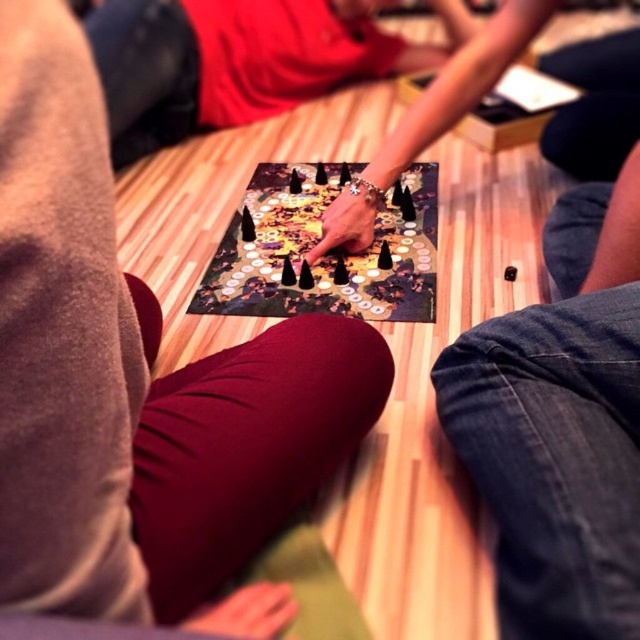
Between point (588, 576) and point (195, 83), which one is positioned in front?

Point (588, 576)

From the picture: Between denim pants at lower right and smooth red shirt at center, which one appears on the left side from the viewer's perspective?

smooth red shirt at center is more to the left.

Is point (595, 486) positioned after point (227, 60)?

No, it is not.

The image size is (640, 640). Find the location of `denim pants at lower right`. denim pants at lower right is located at coordinates (561, 422).

Who is higher up, denim pants at lower right or black plastic board game at center?

black plastic board game at center

Can you confirm if denim pants at lower right is positioned above black plastic board game at center?

No.

Between point (500, 445) and point (262, 192), which one is positioned behind?

The point (262, 192) is behind.

Where is `denim pants at lower right`? The image size is (640, 640). denim pants at lower right is located at coordinates (561, 422).

Is smooth black hand at center closer to camera compared to denim pants at lower right?

Yes, it is.

How far apart are smooth black hand at center and denim pants at lower right?

13.30 inches

I want to click on smooth black hand at center, so click(x=132, y=376).

Locate an element on the screen. The width and height of the screenshot is (640, 640). smooth black hand at center is located at coordinates (132, 376).